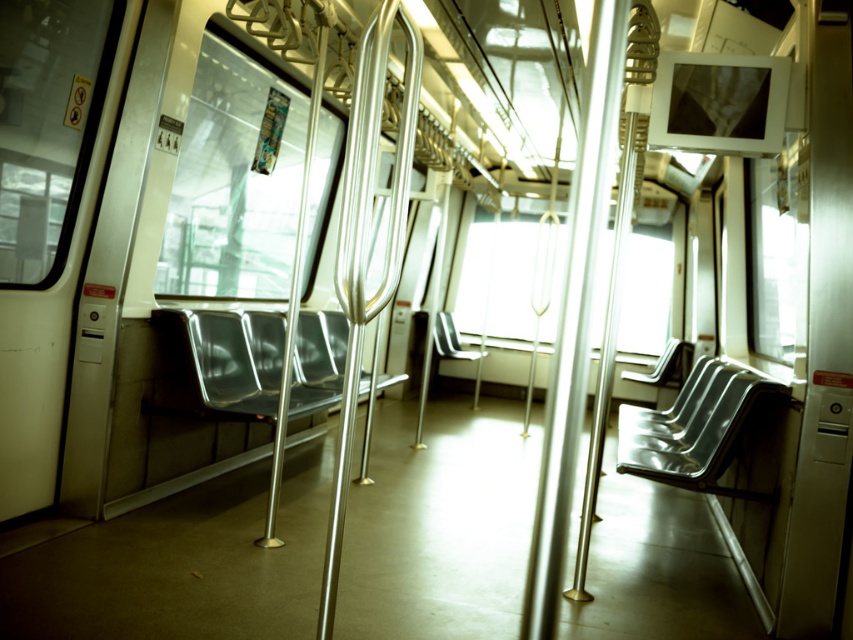
You are standing at the point with coordinates (366, 243) in the train car. What object is located exactly at that point?

The polished metal handrail at center is located exactly at point (366, 243).

You are a passenger carrying a large suitcase that is 2 meters long. You are standing in the train and want to place your suitcase on the floor near the metallic silver seat at right. Is there enough space between you and the seat to place your suitcase?

The metallic silver seat at right is 3.83 meters away from the viewer. Since the suitcase is 2 meters long, there is sufficient space to place it between you and the seat as the distance is greater than the suitcase length.

You are a passenger standing in the middle of the train car and need to grab something from the floor. Which object between the polished metal handrail at center and the metallic silver seat at center is closer to the floor?

The metallic silver seat at center is closer to the floor because the polished metal handrail at center is much taller than it.